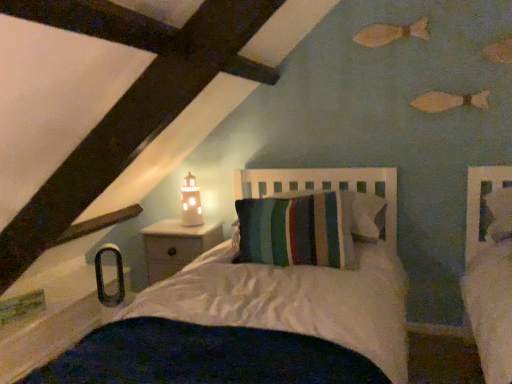
The height and width of the screenshot is (384, 512). What do you see at coordinates (176, 245) in the screenshot?
I see `white wood nightstand at lower left` at bounding box center [176, 245].

Image resolution: width=512 pixels, height=384 pixels. What do you see at coordinates (365, 214) in the screenshot?
I see `striped fabric pillow at center` at bounding box center [365, 214].

This screenshot has height=384, width=512. I want to click on matte white lighthouse at upper center, so click(191, 203).

How different are the orientations of white wood nightstand at lower left and striped fabric pillow at center in degrees?

92 degrees.

Is striped fabric pillow at center at the back of white wood nightstand at lower left?

No, white wood nightstand at lower left is not facing away from striped fabric pillow at center.

Is white wood nightstand at lower left placed right next to striped fabric pillow at center?

white wood nightstand at lower left and striped fabric pillow at center are clearly separated.

From a real-world perspective, who is located lower, white wood nightstand at lower left or striped fabric pillow at center?

From a 3D spatial view, white wood nightstand at lower left is below.

Is white wood nightstand at lower left not near matte white lighthouse at upper center?

No, white wood nightstand at lower left is not far from matte white lighthouse at upper center.

Looking at this image, is white wood nightstand at lower left not inside matte white lighthouse at upper center?

Yes, white wood nightstand at lower left is outside of matte white lighthouse at upper center.

From a real-world perspective, which object rests below the other?

white wood nightstand at lower left, from a real-world perspective.

Considering the relative positions of white wood nightstand at lower left and matte white lighthouse at upper center in the image provided, is white wood nightstand at lower left to the right of matte white lighthouse at upper center from the viewer's perspective?

No, white wood nightstand at lower left is not to the right of matte white lighthouse at upper center.

Between matte white lighthouse at upper center and white wood nightstand at lower left, which one appears on the left side from the viewer's perspective?

Positioned to the left is white wood nightstand at lower left.

Between matte white lighthouse at upper center and white wood nightstand at lower left, which one has less height?

With less height is matte white lighthouse at upper center.

Locate an element on the screen. nightstand on the left of matte white lighthouse at upper center is located at coordinates (176, 245).

Does point (378, 232) lie behind point (182, 237)?

No.

Locate an element on the screen. pillow above the white wood nightstand at lower left (from the image's perspective) is located at coordinates tap(365, 214).

How much distance is there between striped fabric pillow at center and white wood nightstand at lower left?

striped fabric pillow at center and white wood nightstand at lower left are 37.62 inches apart.

Is striped fabric pillow at center looking in the opposite direction of white wood nightstand at lower left?

striped fabric pillow at center does not have its back to white wood nightstand at lower left.

Considering the sizes of objects striped fabric pillow at center and matte white lighthouse at upper center in the image provided, who is thinner, striped fabric pillow at center or matte white lighthouse at upper center?

matte white lighthouse at upper center.

Which is correct: striped fabric pillow at center is inside matte white lighthouse at upper center, or outside of it?

striped fabric pillow at center is not inside matte white lighthouse at upper center, it's outside.

Is striped fabric pillow at center to the left or to the right of matte white lighthouse at upper center in the image?

striped fabric pillow at center is to the right of matte white lighthouse at upper center.

Is striped fabric pillow at center far from matte white lighthouse at upper center?

That's not correct — striped fabric pillow at center is a little close to matte white lighthouse at upper center.

From the image's perspective, is matte white lighthouse at upper center positioned above or below striped fabric pillow at center?

matte white lighthouse at upper center is above striped fabric pillow at center.

Identify the location of table lamp above the striped fabric pillow at center (from the image's perspective). The width and height of the screenshot is (512, 384). (191, 203).

Are matte white lighthouse at upper center and striped fabric pillow at center beside each other?

There is a gap between matte white lighthouse at upper center and striped fabric pillow at center.

Considering the positions of objects matte white lighthouse at upper center and striped fabric pillow at center in the image provided, who is more to the right, matte white lighthouse at upper center or striped fabric pillow at center?

Positioned to the right is striped fabric pillow at center.

Where is `pillow that appears on the right of white wood nightstand at lower left`? This screenshot has width=512, height=384. pillow that appears on the right of white wood nightstand at lower left is located at coordinates (365, 214).

Locate an element on the screen. table lamp located behind the white wood nightstand at lower left is located at coordinates (191, 203).

From the image, which object appears to be nearer to white wood nightstand at lower left, striped fabric pillow at center or matte white lighthouse at upper center?

matte white lighthouse at upper center is closer to white wood nightstand at lower left.

Which object lies nearer to the anchor point striped fabric pillow at center, white wood nightstand at lower left or matte white lighthouse at upper center?

white wood nightstand at lower left is positioned closer to the anchor striped fabric pillow at center.

Which object lies further to the anchor point striped fabric pillow at center, matte white lighthouse at upper center or white wood nightstand at lower left?

matte white lighthouse at upper center.

When comparing their distances from matte white lighthouse at upper center, does white wood nightstand at lower left or striped fabric pillow at center seem further?

striped fabric pillow at center is positioned further to the anchor matte white lighthouse at upper center.

Looking at this image, which object lies further to the anchor point white wood nightstand at lower left, matte white lighthouse at upper center or striped fabric pillow at center?

striped fabric pillow at center lies further to white wood nightstand at lower left than the other object.

Looking at the image, which one is located closer to matte white lighthouse at upper center, striped fabric pillow at center or white wood nightstand at lower left?

Based on the image, white wood nightstand at lower left appears to be nearer to matte white lighthouse at upper center.

Locate an element on the screen. Image resolution: width=512 pixels, height=384 pixels. table lamp between white wood nightstand at lower left and striped fabric pillow at center in the horizontal direction is located at coordinates [x=191, y=203].